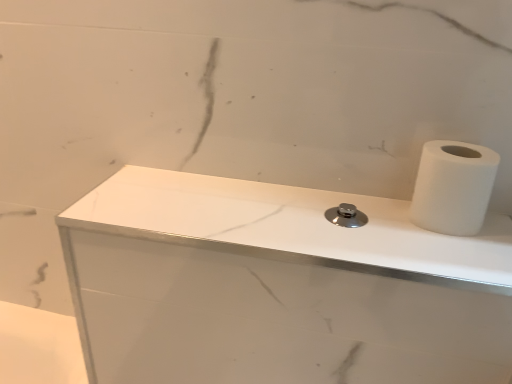
Find the location of a particular element. vacant space positioned to the left of white matte paper towel at right is located at coordinates (337, 216).